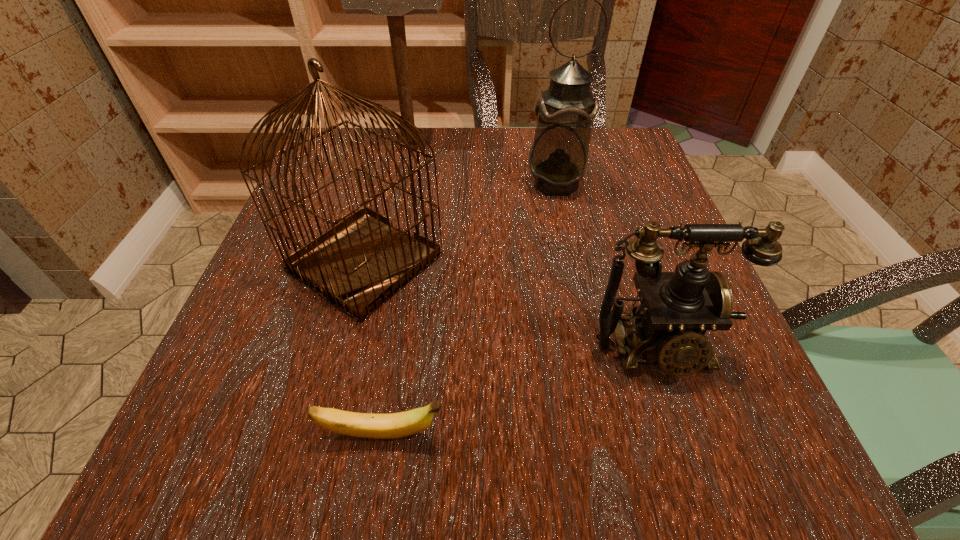
This screenshot has width=960, height=540. I want to click on free space that is in between the fourth nearest object and the birdcage, so click(x=460, y=223).

Find the location of a particular element. This screenshot has height=540, width=960. free spot between the nearest object and the oil lamp is located at coordinates (469, 309).

Find the location of `free spot between the second shortest object and the shortest object`. free spot between the second shortest object and the shortest object is located at coordinates (519, 392).

Find the location of a particular element. This screenshot has height=540, width=960. vacant space that is in between the birdcage and the fourth tallest object is located at coordinates (511, 305).

Locate an element on the screen. vacant point located between the banana and the birdcage is located at coordinates (373, 348).

Identify the location of object that stands as the third closest to the banana. This screenshot has width=960, height=540. (558, 159).

Where is `object that can be found as the second closest to the nearest object`? This screenshot has width=960, height=540. object that can be found as the second closest to the nearest object is located at coordinates (677, 308).

The width and height of the screenshot is (960, 540). What are the coordinates of `blank area in the image that satisfies the following two spatial constraints: 1. on the rotary dial of the fourth tallest object; 2. at the stem of the shortest object` in the screenshot? It's located at (684, 434).

Find the location of a particular element. The height and width of the screenshot is (540, 960). free space that satisfies the following two spatial constraints: 1. on the striking face of the mallet; 2. on the left side of the oil lamp is located at coordinates (401, 184).

In order to click on free space that satisfies the following two spatial constraints: 1. on the striking face of the mallet; 2. on the back side of the oil lamp in this screenshot , I will do `click(401, 184)`.